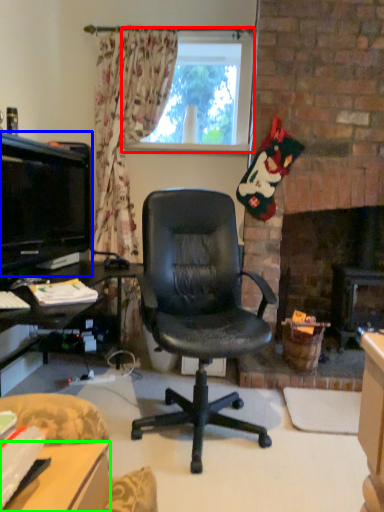
Question: Considering the real-world distances, which object is farthest from window (highlighted by a red box)? television (highlighted by a blue box) or desk (highlighted by a green box)?

Choices:
 (A) television
 (B) desk

Answer: (B)